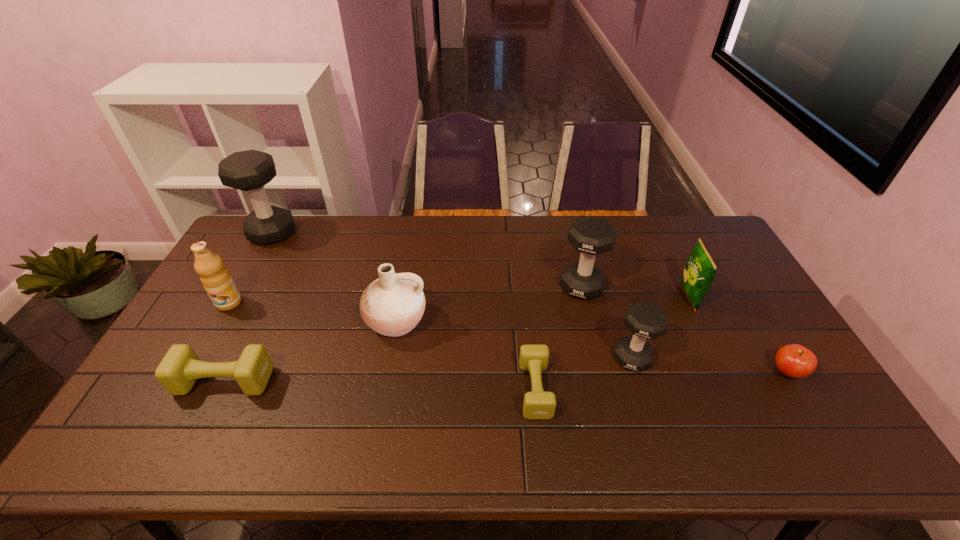
Where is `the third shortest dumbbell`? The width and height of the screenshot is (960, 540). the third shortest dumbbell is located at coordinates (645, 320).

Locate an element on the screen. Image resolution: width=960 pixels, height=540 pixels. the left olive dumbbell is located at coordinates (178, 371).

Where is `the bigger olive dumbbell`? The image size is (960, 540). the bigger olive dumbbell is located at coordinates (178, 371).

This screenshot has height=540, width=960. Find the location of `the rightmost object`. the rightmost object is located at coordinates (793, 360).

Where is `the third dumbbell from right to left`? the third dumbbell from right to left is located at coordinates (538, 404).

Locate an element on the screen. the shortest object is located at coordinates (538, 404).

Where is `vacant region located 0.370m on the right of the biggest gray dumbbell`? The height and width of the screenshot is (540, 960). vacant region located 0.370m on the right of the biggest gray dumbbell is located at coordinates (396, 233).

Find the location of a particular element. Image resolution: width=960 pixels, height=540 pixels. vacant point located on the front of the second tallest dumbbell is located at coordinates (593, 335).

Where is `free space located 0.400m on the label of the olive oil`? This screenshot has width=960, height=540. free space located 0.400m on the label of the olive oil is located at coordinates (154, 434).

The width and height of the screenshot is (960, 540). Identify the location of vacant space positioned 0.210m to pour from the handle of the pottery. (379, 412).